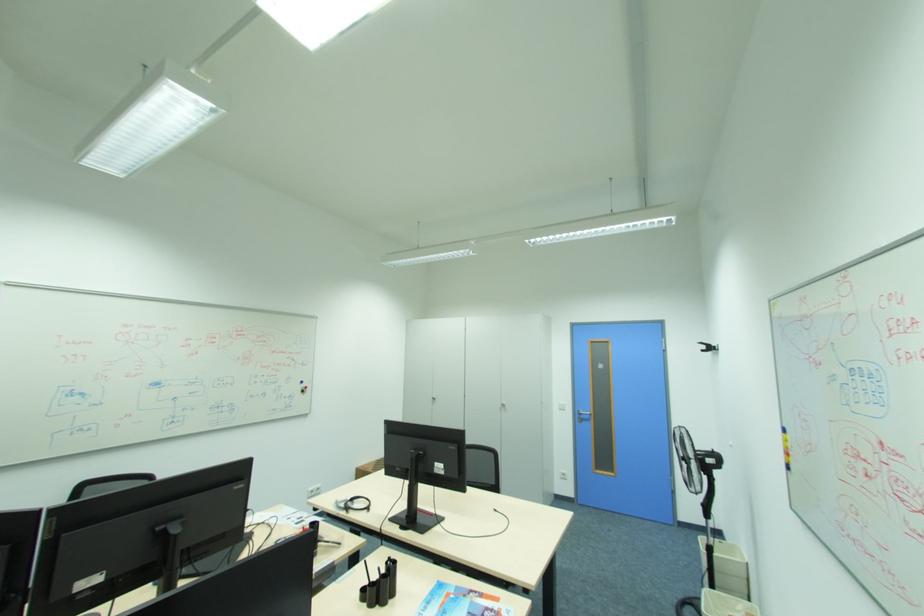
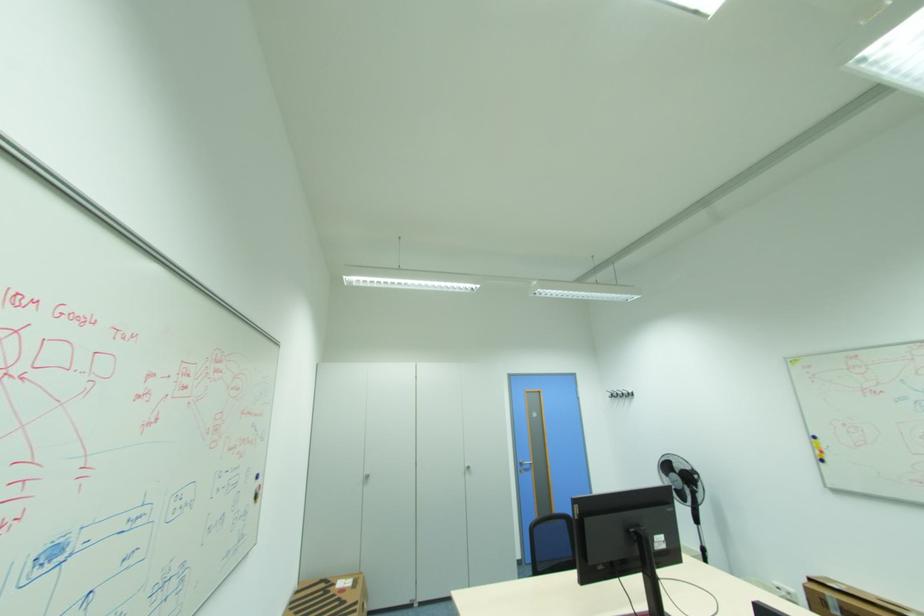
The point at (440, 399) is marked in the first image. Where is the corresponding point in the second image?

(372, 477)